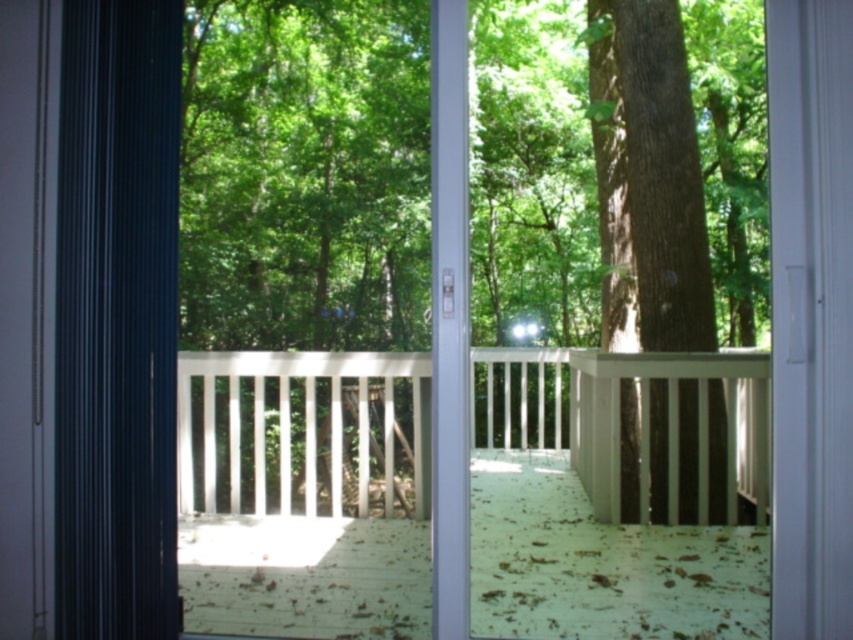
Is point (225, 540) closer to viewer compared to point (173, 291)?

No, (225, 540) is further to viewer.

Measure the distance between white wooden porch at center and camera.

white wooden porch at center and camera are 9.67 feet apart from each other.

Identify the location of white wooden porch at center. (305, 493).

Does point (148, 358) come closer to viewer compared to point (694, 387)?

That is True.

Is point (106, 211) farther from camera compared to point (692, 272)?

That is False.

Find the location of a particular element. The width and height of the screenshot is (853, 640). black fabric curtain at left is located at coordinates (115, 321).

Find the location of `black fabric curtain at left`. black fabric curtain at left is located at coordinates [115, 321].

Between white wooden porch at center and brown rough bark tree at center, which one is positioned lower?

white wooden porch at center

Does point (268, 362) lie behind point (717, 474)?

No, it is in front of (717, 474).

Locate an element on the screen. This screenshot has width=853, height=640. white wooden porch at center is located at coordinates (305, 493).